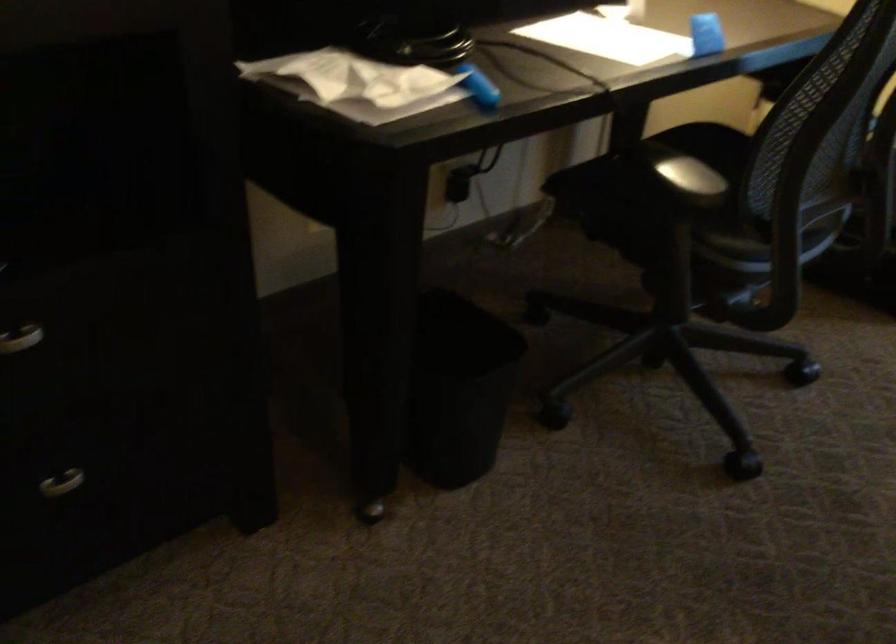
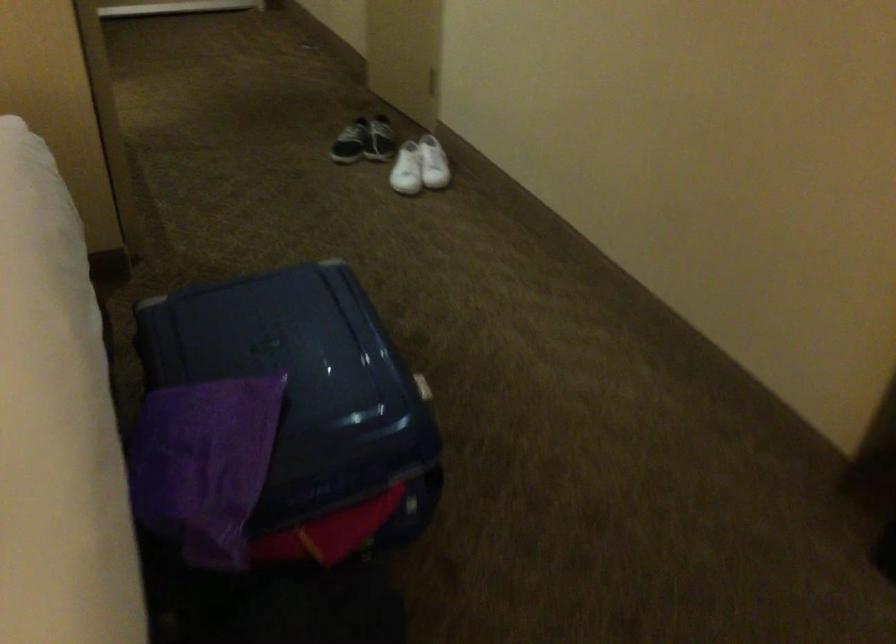
How did the camera likely rotate?

The camera rotated toward left-down.